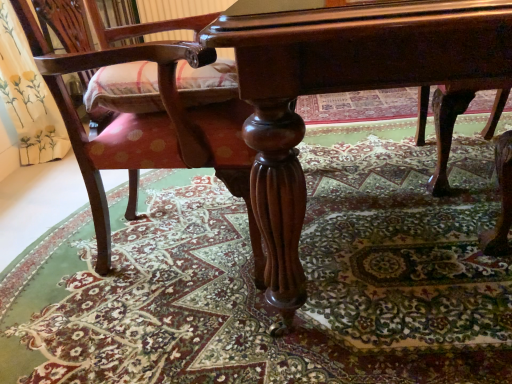
Describe the element at coordinates (261, 293) in the screenshot. I see `carpeted floor at center` at that location.

In order to click on polished wood chair at lower left in this screenshot , I will do `click(149, 130)`.

Does carpeted floor at center turn towards polished dark wood table at center?

No, carpeted floor at center is not oriented towards polished dark wood table at center.

Are carpeted floor at center and polished dark wood table at center located far from each other?

No, carpeted floor at center is in close proximity to polished dark wood table at center.

Does carpeted floor at center have a smaller size compared to polished dark wood table at center?

Yes, carpeted floor at center is smaller than polished dark wood table at center.

In the scene shown: Between carpeted floor at center and polished dark wood table at center, which one is positioned behind?

carpeted floor at center is behind.

From a real-world perspective, is carpeted floor at center positioned above or below polished wood chair at lower left?

carpeted floor at center is situated lower than polished wood chair at lower left in the real world.

Between carpeted floor at center and polished wood chair at lower left, which one has smaller width?

With smaller width is polished wood chair at lower left.

Is carpeted floor at center looking in the opposite direction of polished wood chair at lower left?

No, polished wood chair at lower left is not at the back of carpeted floor at center.

From the image's perspective, between carpeted floor at center and polished wood chair at lower left, who is located below?

carpeted floor at center.

At what (x,y) coordinates should I click in order to perform the action: click on chair above the carpeted floor at center (from the image's perspective). Please return your answer as a coordinate pair (x, y). The image size is (512, 384). Looking at the image, I should click on (149, 130).

How different are the orientations of polished wood chair at lower left and carpeted floor at center in degrees?

polished wood chair at lower left and carpeted floor at center are facing 90.5 degrees away from each other.

From their relative heights in the image, would you say polished wood chair at lower left is taller or shorter than carpeted floor at center?

In the image, polished wood chair at lower left appears to be taller than carpeted floor at center.

Can you confirm if polished wood chair at lower left is smaller than carpeted floor at center?

Incorrect, polished wood chair at lower left is not smaller in size than carpeted floor at center.

Is there a large distance between polished dark wood table at center and carpeted floor at center?

They are positioned close to each other.

From the image's perspective, is polished dark wood table at center located above carpeted floor at center?

Yes, from the image's perspective, polished dark wood table at center is above carpeted floor at center.

The image size is (512, 384). Identify the location of mat behind the polished dark wood table at center. pos(261,293).

From a real-world perspective, is polished dark wood table at center beneath carpeted floor at center?

No, from a real-world perspective, polished dark wood table at center is not below carpeted floor at center.

Considering the sizes of polished wood chair at lower left and polished dark wood table at center in the image, is polished wood chair at lower left wider or thinner than polished dark wood table at center?

In the image, polished wood chair at lower left appears to be more narrow than polished dark wood table at center.

Where is `chair located above the polished dark wood table at center (from a real-world perspective)`? The width and height of the screenshot is (512, 384). chair located above the polished dark wood table at center (from a real-world perspective) is located at coordinates click(149, 130).

Would you say polished dark wood table at center is part of polished wood chair at lower left's contents?

No, polished wood chair at lower left does not contain polished dark wood table at center.

Is polished wood chair at lower left not near polished dark wood table at center?

No, polished wood chair at lower left is not far from polished dark wood table at center.

In terms of size, does polished dark wood table at center appear bigger or smaller than polished wood chair at lower left?

polished dark wood table at center is bigger than polished wood chair at lower left.

Would you say polished dark wood table at center is a long distance from polished wood chair at lower left?

polished dark wood table at center is near polished wood chair at lower left, not far away.

Does polished dark wood table at center have a lesser height compared to polished wood chair at lower left?

Correct, polished dark wood table at center is not as tall as polished wood chair at lower left.

From the image's perspective, which one is positioned lower, polished dark wood table at center or polished wood chair at lower left?

polished wood chair at lower left, from the image's perspective.

Identify the location of table in front of the carpeted floor at center. (346, 90).

Where is `chair above the carpeted floor at center (from a real-world perspective)`? This screenshot has height=384, width=512. chair above the carpeted floor at center (from a real-world perspective) is located at coordinates (149, 130).

Looking at this image, considering their positions, is carpeted floor at center positioned further to polished dark wood table at center than polished wood chair at lower left?

carpeted floor at center is positioned further to the anchor polished dark wood table at center.

Considering their positions, is polished dark wood table at center positioned closer to polished wood chair at lower left than carpeted floor at center?

Based on the image, polished dark wood table at center appears to be nearer to polished wood chair at lower left.

Based on their spatial positions, is polished dark wood table at center or polished wood chair at lower left further from carpeted floor at center?

polished dark wood table at center lies further to carpeted floor at center than the other object.

Looking at the image, which one is located closer to polished dark wood table at center, polished wood chair at lower left or carpeted floor at center?

The object closer to polished dark wood table at center is polished wood chair at lower left.

Looking at the image, which one is located closer to polished wood chair at lower left, carpeted floor at center or polished dark wood table at center?

Among the two, polished dark wood table at center is located nearer to polished wood chair at lower left.

Considering their positions, is polished wood chair at lower left positioned closer to carpeted floor at center than polished dark wood table at center?

polished wood chair at lower left lies closer to carpeted floor at center than the other object.

In order to click on mat between polished wood chair at lower left and polished dark wood table at center in this screenshot , I will do `click(261, 293)`.